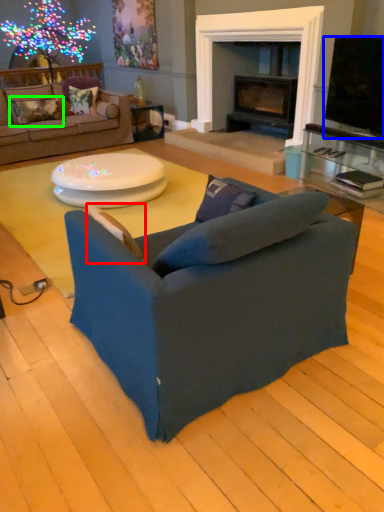
Question: Which is nearer to the pillow (highlighted by a red box)? television (highlighted by a blue box) or pillow (highlighted by a green box).

Choices:
 (A) television
 (B) pillow

Answer: (A)